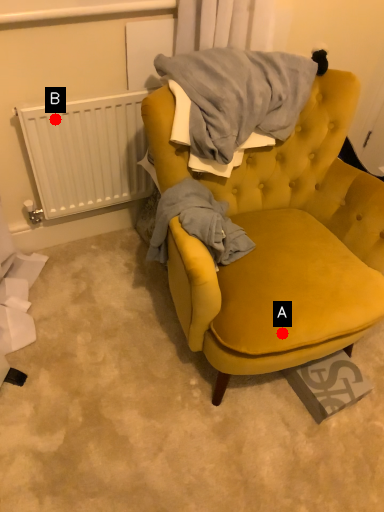
Question: Two points are circled on the image, labeled by A and B beside each circle. Which point appears closest to the camera in this image?

Choices:
 (A) A is closer
 (B) B is closer

Answer: (A)